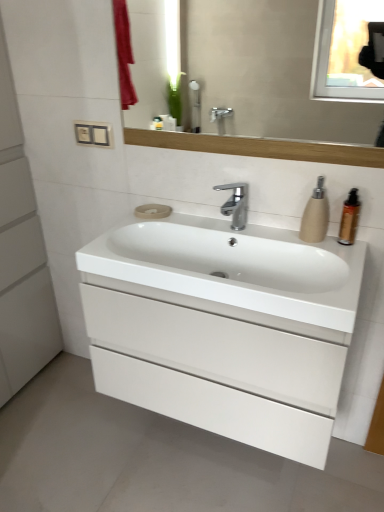
Question: From the image's perspective, is matte wooden mirror at upper center under white glossy sink at center?

Choices:
 (A) no
 (B) yes

Answer: (A)

Question: Is matte wooden mirror at upper center oriented away from white glossy sink at center?

Choices:
 (A) yes
 (B) no

Answer: (B)

Question: Is matte wooden mirror at upper center touching white glossy sink at center?

Choices:
 (A) yes
 (B) no

Answer: (B)

Question: Is matte wooden mirror at upper center further to camera compared to white glossy sink at center?

Choices:
 (A) no
 (B) yes

Answer: (B)

Question: Can you confirm if matte wooden mirror at upper center is smaller than white glossy sink at center?

Choices:
 (A) yes
 (B) no

Answer: (A)

Question: In the image, is white glossy cabinet at center on the left side or the right side of polished chrome faucet at center?

Choices:
 (A) left
 (B) right

Answer: (A)

Question: Relative to polished chrome faucet at center, is white glossy cabinet at center in front or behind?

Choices:
 (A) front
 (B) behind

Answer: (A)

Question: Looking at the image, does white glossy cabinet at center seem bigger or smaller compared to polished chrome faucet at center?

Choices:
 (A) small
 (B) big

Answer: (B)

Question: From a real-world perspective, is white glossy cabinet at center above or below polished chrome faucet at center?

Choices:
 (A) below
 (B) above

Answer: (A)

Question: Is point (352, 221) closer or farther from the camera than point (6, 118)?

Choices:
 (A) closer
 (B) farther

Answer: (A)

Question: Is brown glossy bottle at right in front of or behind white matte cabinet at left in the image?

Choices:
 (A) front
 (B) behind

Answer: (B)

Question: Is brown glossy bottle at right inside or outside of white matte cabinet at left?

Choices:
 (A) outside
 (B) inside

Answer: (A)

Question: Based on their positions, is brown glossy bottle at right located to the left or right of white matte cabinet at left?

Choices:
 (A) right
 (B) left

Answer: (A)

Question: Considering the positions of point (145, 215) and point (8, 307), is point (145, 215) closer or farther from the camera than point (8, 307)?

Choices:
 (A) farther
 (B) closer

Answer: (B)

Question: From a real-world perspective, is beige matte soap at center positioned above or below white matte cabinet at left?

Choices:
 (A) below
 (B) above

Answer: (B)